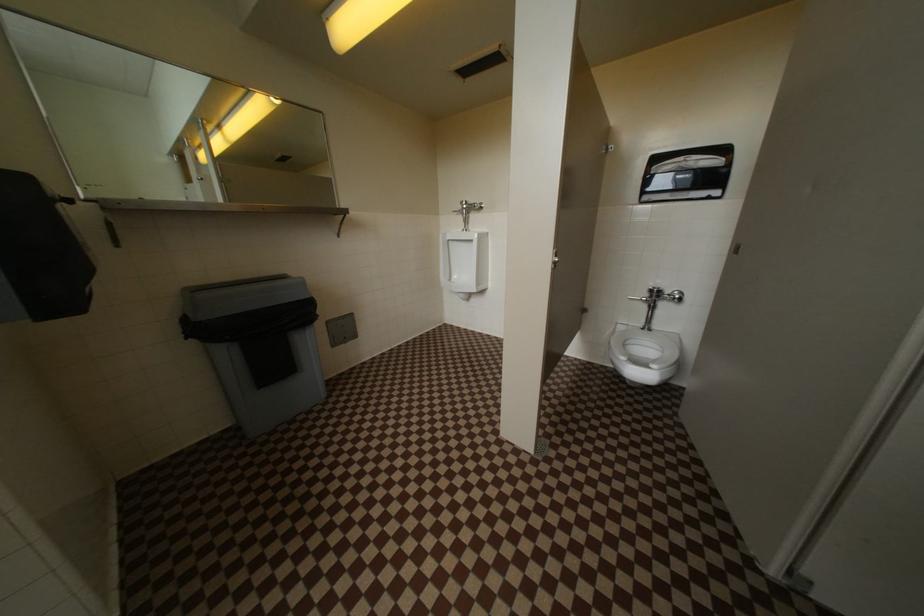
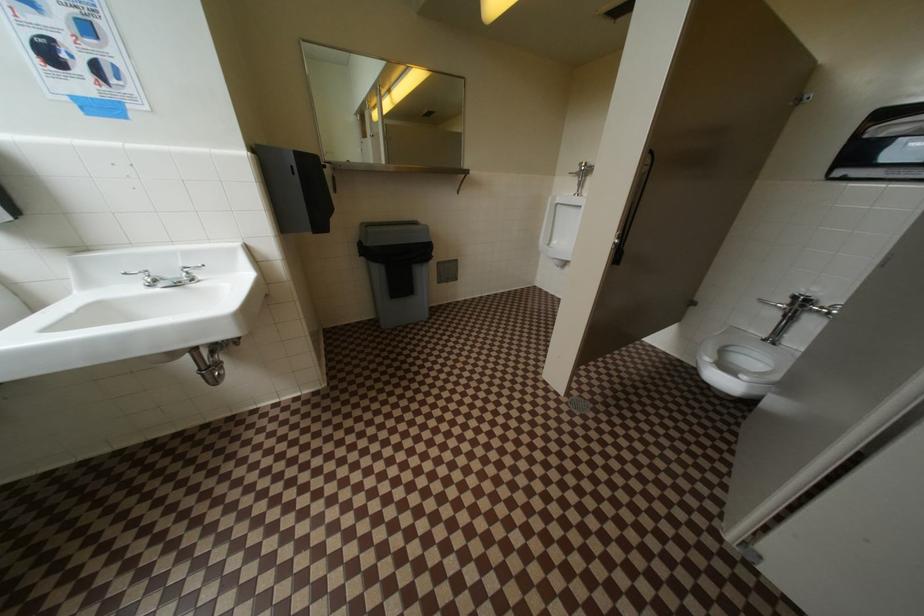
In a continuous first-person perspective shot, in which direction is the camera moving?

The cameraman walked toward right, backward.